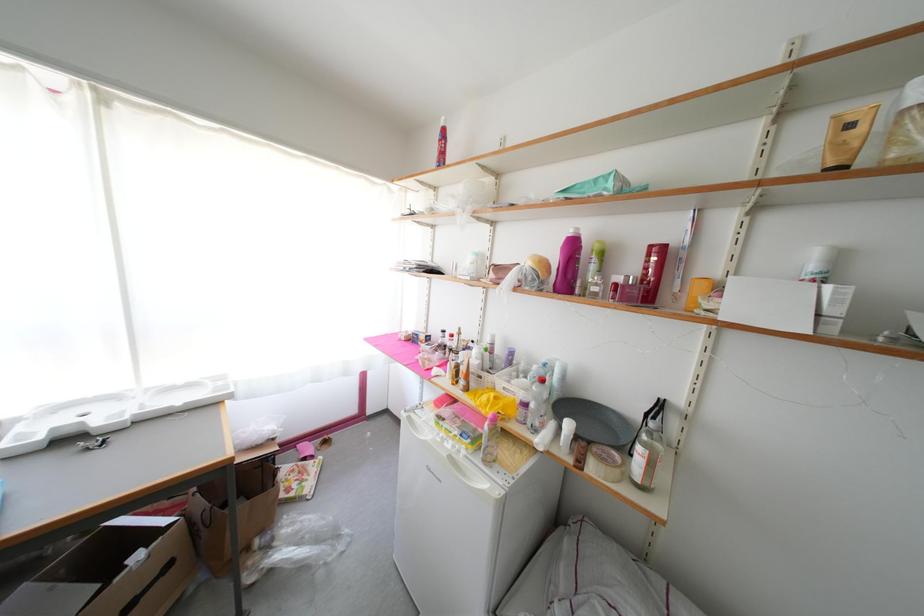
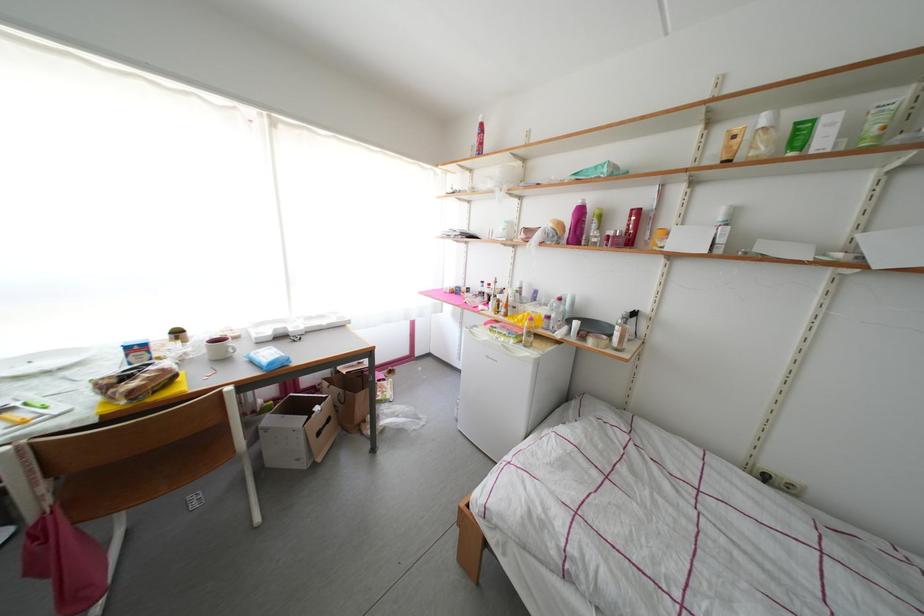
Question: The first image is from the beginning of the video and the second image is from the end. How did the camera likely rotate when shooting the video?

Choices:
 (A) Left
 (B) Right
 (C) Up
 (D) Down

Answer: (D)